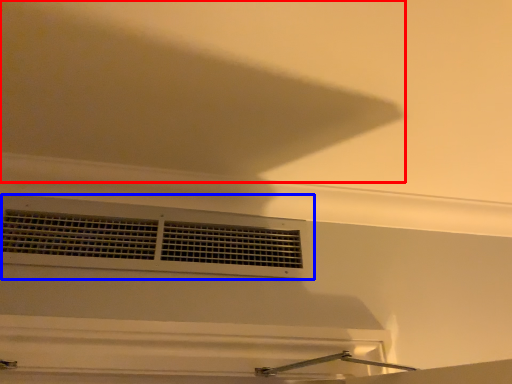
Question: Which object appears closest to the camera in this image, exhaust hood (highlighted by a red box) or window (highlighted by a blue box)?

Choices:
 (A) exhaust hood
 (B) window

Answer: (A)